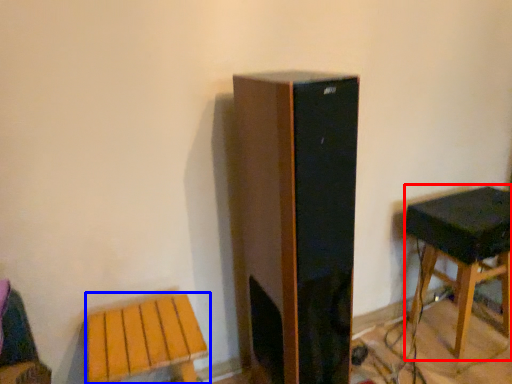
Question: Which point is closer to the camera, stool (highlighted by a red box) or stool (highlighted by a blue box)?

Choices:
 (A) stool
 (B) stool

Answer: (B)